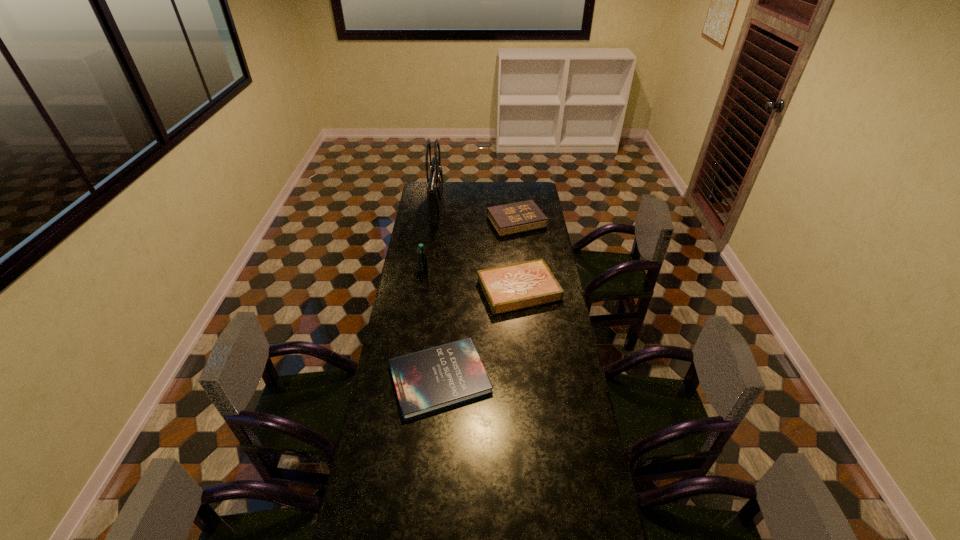
Find the location of a particular element. The image size is (960, 540). the tallest object is located at coordinates (435, 180).

Locate an element on the screen. the fourth shortest object is located at coordinates (422, 259).

You are a GUI agent. You are given a task and a screenshot of the screen. Output one action in this format:
    pyautogui.click(x=<x>, y=<y>)
    Task: Click on the tallest hardback book
    
    Given the screenshot: What is the action you would take?
    pyautogui.click(x=524, y=216)

The height and width of the screenshot is (540, 960). What are the coordinates of `the farthest hardback book` in the screenshot? It's located at (524, 216).

Locate an element on the screen. the second nearest hardback book is located at coordinates (506, 288).

Where is `the second tallest hardback book`? The image size is (960, 540). the second tallest hardback book is located at coordinates (506, 288).

What are the coordinates of `the nearest hardback book` in the screenshot? It's located at (426, 381).

You are a GUI agent. You are given a task and a screenshot of the screen. Output one action in this format:
    pyautogui.click(x=<x>, y=<y>)
    Task: Click on the nearest object
    The image size is (960, 540).
    Given the screenshot: What is the action you would take?
    pyautogui.click(x=426, y=381)

Locate an element on the screen. Image resolution: width=960 pixels, height=540 pixels. free space located with an open clasp on the front of the tallest object is located at coordinates (472, 208).

Where is `vacant point located on the back of the water bottle`? Image resolution: width=960 pixels, height=540 pixels. vacant point located on the back of the water bottle is located at coordinates point(425,262).